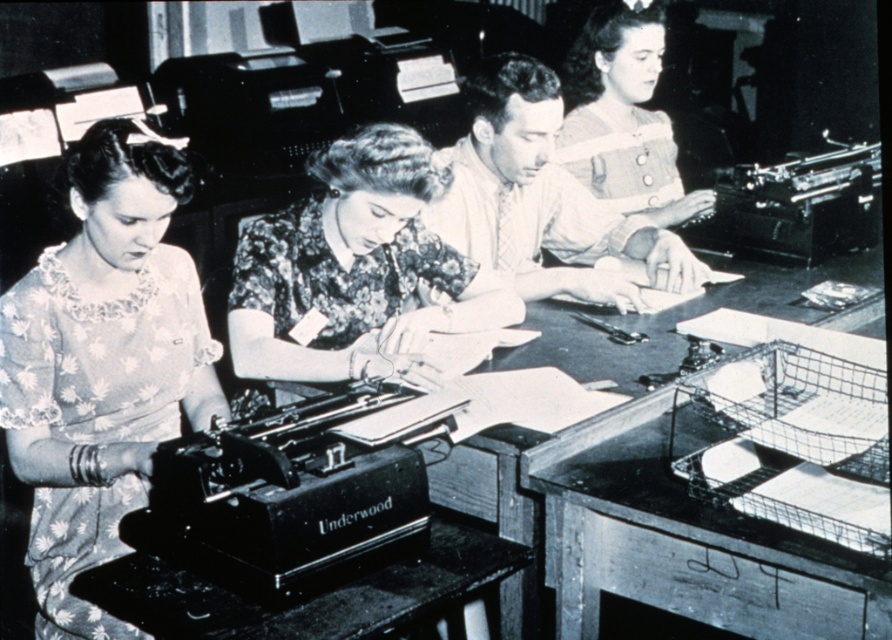
Question: Among these points, which one is nearest to the camera?

Choices:
 (A) (122, 424)
 (B) (666, 122)

Answer: (A)

Question: Can you confirm if floral lace blouse at left is positioned to the left of metallic black typewriter at lower left?

Choices:
 (A) no
 (B) yes

Answer: (B)

Question: Considering the relative positions of metallic black typewriter at lower left and matte brown blouse at center in the image provided, where is metallic black typewriter at lower left located with respect to matte brown blouse at center?

Choices:
 (A) above
 (B) below

Answer: (B)

Question: Which point appears farthest from the camera in this image?

Choices:
 (A) (397, 241)
 (B) (145, 257)
 (C) (657, 38)
 (D) (326, 493)

Answer: (C)

Question: From the image, what is the correct spatial relationship of floral fabric blouse at center in relation to metallic black typewriter at lower left?

Choices:
 (A) left
 (B) right

Answer: (B)

Question: Which of the following is the closest to the observer?

Choices:
 (A) floral lace blouse at left
 (B) metallic black typewriter at lower left
 (C) matte brown blouse at center
 (D) floral fabric blouse at center

Answer: (B)